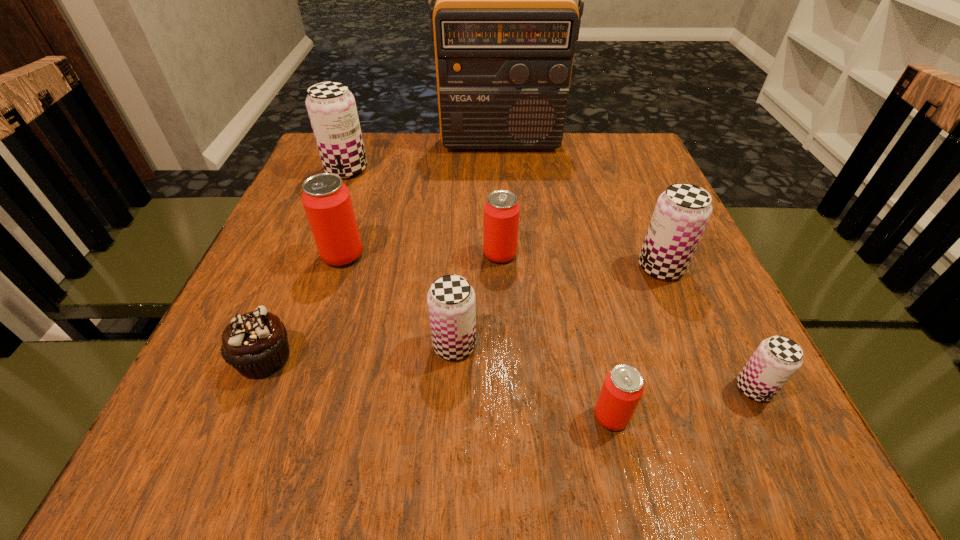
The image size is (960, 540). What are the coordinates of `vacant space at the left edge` in the screenshot? It's located at (306, 312).

You are a GUI agent. You are given a task and a screenshot of the screen. Output one action in this format:
    pyautogui.click(x=<x>, y=<y>)
    Task: Click on the free space at the right edge of the desktop
    Image resolution: width=960 pixels, height=540 pixels.
    Given the screenshot: What is the action you would take?
    pyautogui.click(x=767, y=411)

The width and height of the screenshot is (960, 540). I want to click on vacant space at the near left corner of the desktop, so click(x=164, y=453).

The width and height of the screenshot is (960, 540). In the image, there is a desktop. In order to click on vacant space at the near right corner in this screenshot , I will do `click(749, 467)`.

Locate an element on the screen. The height and width of the screenshot is (540, 960). vacant region between the leftmost red beer can and the cupcake is located at coordinates (303, 307).

Find the location of `free spot between the nearest purple beer can and the radio receiver`. free spot between the nearest purple beer can and the radio receiver is located at coordinates (627, 266).

Find the location of a particular element. The height and width of the screenshot is (540, 960). free point between the biggest red beer can and the smallest red beer can is located at coordinates (477, 336).

Where is `vacant space that's between the second red beer can from right to left and the fifth beer can from right to left`? The height and width of the screenshot is (540, 960). vacant space that's between the second red beer can from right to left and the fifth beer can from right to left is located at coordinates (477, 300).

At what (x,y) coordinates should I click in order to perform the action: click on empty space between the smallest red beer can and the biggest red beer can. Please return your answer as a coordinate pair (x, y). This screenshot has height=540, width=960. Looking at the image, I should click on (477, 336).

You are a GUI agent. You are given a task and a screenshot of the screen. Output one action in this format:
    pyautogui.click(x=<x>, y=<y>)
    Task: Click on the free space between the leftmost red beer can and the radio receiver
    This screenshot has height=540, width=960.
    Given the screenshot: What is the action you would take?
    pyautogui.click(x=421, y=199)